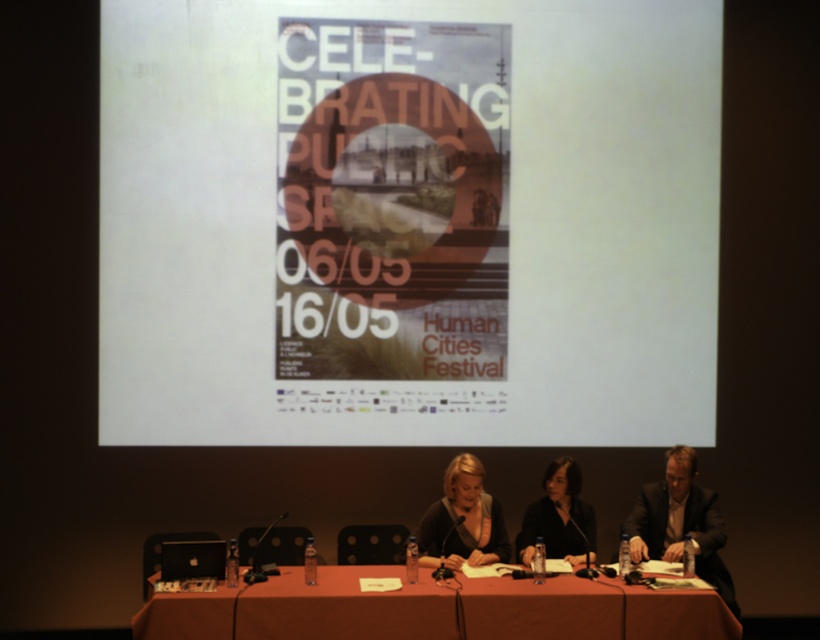
You are organizing a presentation and need to place a large poster on the table. The poster is the same size as the white paper at center. Will it fit on the smooth brown table at center?

The white paper at center has a larger size compared to smooth brown table at center. Therefore, the poster, being the same size as the white paper at center, will not fit on the smooth brown table at center.

You are an event organizer setting up for a panel discussion. You have a smooth brown table at center and a dark gray suit at center. Which object is closer to the audience sitting in front of the stage?

The smooth brown table at center is closer to the audience sitting in front of the stage because it is positioned under the dark gray suit at center, meaning the table is lower and likely placed at the front of the stage while the suit is worn by someone seated on it, making the table closer to the audience.